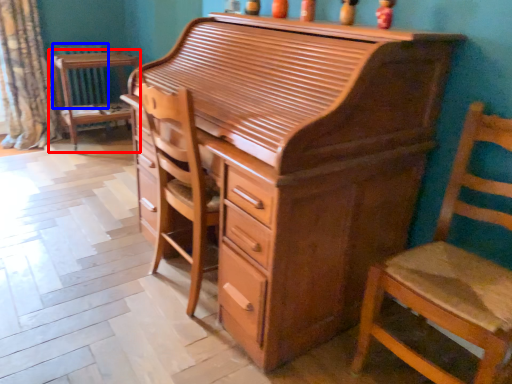
Question: Which object is further to the camera taking this photo, table (highlighted by a red box) or radiator (highlighted by a blue box)?

Choices:
 (A) table
 (B) radiator

Answer: (B)